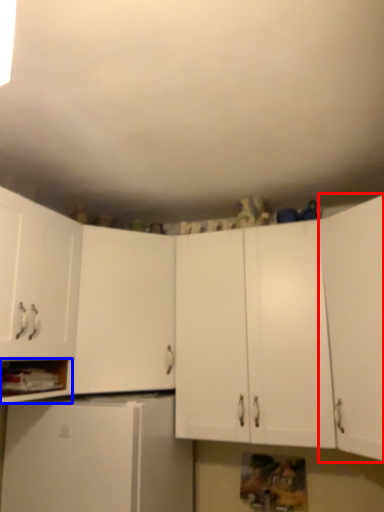
Question: Which of the following is the farthest to the observer, cabinetry (highlighted by a red box) or cabinet (highlighted by a blue box)?

Choices:
 (A) cabinetry
 (B) cabinet

Answer: (B)